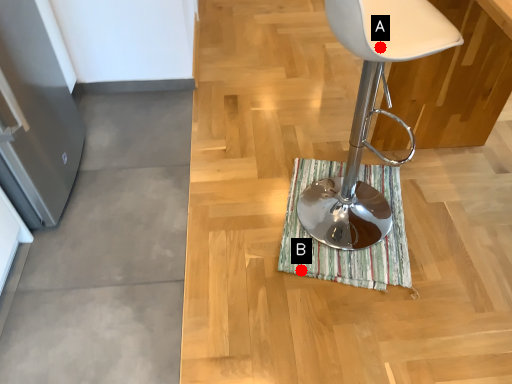
Question: Two points are circled on the image, labeled by A and B beside each circle. Which of the following is the farthest from the observer?

Choices:
 (A) A is further
 (B) B is further

Answer: (B)